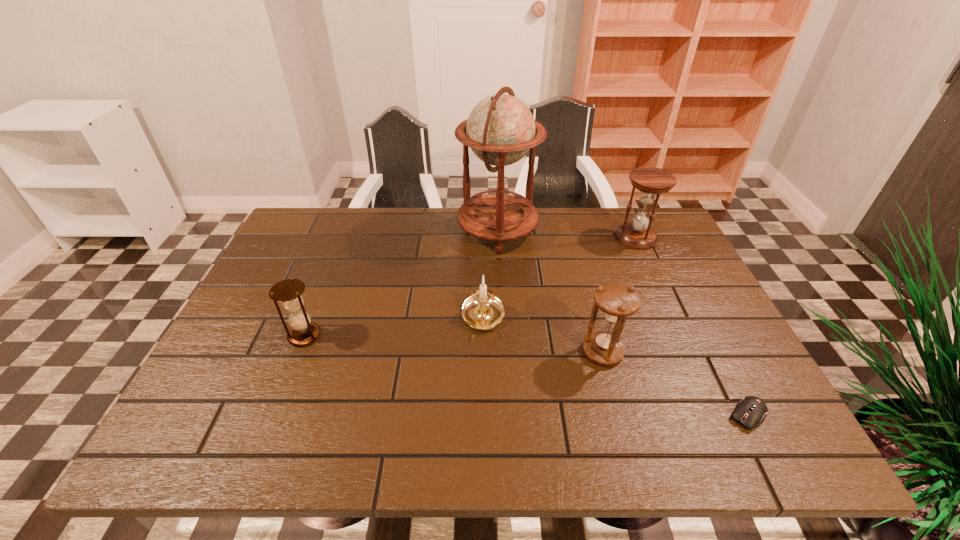
Image resolution: width=960 pixels, height=540 pixels. Identify the location of hourglass identified as the closest to the candle holder. coord(617,301).

Where is `hourglass that is the second closest to the rightmost hourglass`? This screenshot has height=540, width=960. hourglass that is the second closest to the rightmost hourglass is located at coordinates (289, 292).

At what (x,y) coordinates should I click in order to perform the action: click on vacant area in the image that satisfies the following two spatial constraints: 1. on the surface of the tallest object; 2. on the right side of the rightmost hourglass. Please return your answer as a coordinate pair (x, y). This screenshot has height=540, width=960. Looking at the image, I should click on (498, 238).

Find the location of a particular element. The height and width of the screenshot is (540, 960). blank area in the image that satisfies the following two spatial constraints: 1. on the surface of the tallest object; 2. on the front side of the leftmost hourglass is located at coordinates (503, 335).

The width and height of the screenshot is (960, 540). I want to click on vacant space that satisfies the following two spatial constraints: 1. on the surface of the computer mouse; 2. on the right side of the tallest object, so click(x=507, y=415).

Locate an element on the screen. vacant space that satisfies the following two spatial constraints: 1. on the surface of the tallest object; 2. on the right side of the shortest object is located at coordinates (507, 415).

In order to click on vacant space that satisfies the following two spatial constraints: 1. on the handle side of the shortest object; 2. on the right side of the fifth tallest object in this screenshot , I will do click(484, 415).

Find the location of a particular element. free space that satisfies the following two spatial constraints: 1. on the surface of the globe; 2. on the back side of the rightmost hourglass is located at coordinates (498, 238).

Where is `vacant space that satisfies the following two spatial constraints: 1. on the front side of the leftmost hourglass; 2. on the left side of the second hourglass from right to left`? This screenshot has height=540, width=960. vacant space that satisfies the following two spatial constraints: 1. on the front side of the leftmost hourglass; 2. on the left side of the second hourglass from right to left is located at coordinates (298, 352).